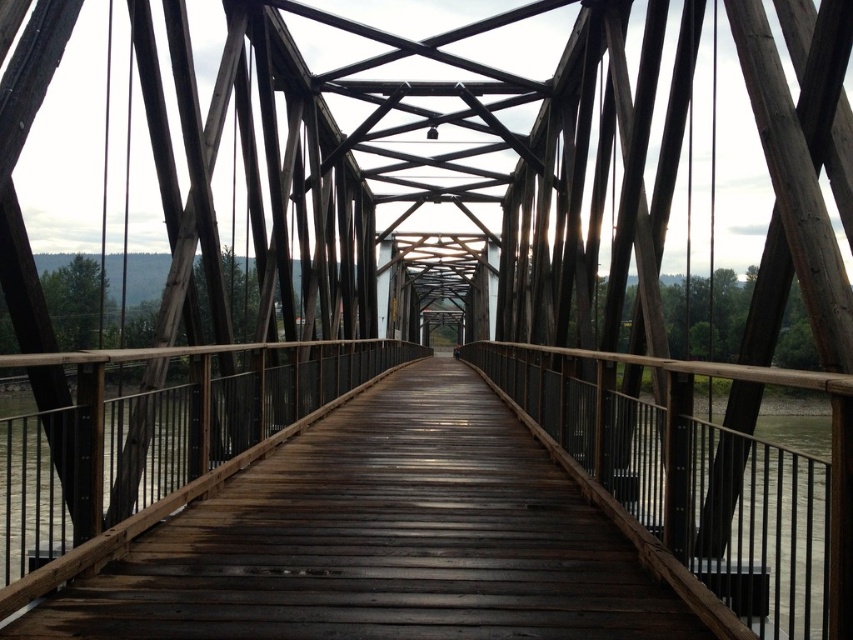
You are standing on the brown wooden bridge at center and want to take a photo of the bridge structure. If your camera is 5.5 feet away from the bridge, will you be able to capture the entire bridge in the photo?

The brown wooden bridge at center and camera are 11.05 feet apart from each other. Since the camera is only 5.5 feet away from the bridge, it is half the required distance. This means the camera is actually 5.5 feet closer than the 11.05 feet separation mentioned. Therefore, you would not be able to capture the entire bridge in the photo because the camera is too close to the bridge structure.

You are standing on the brown wooden bridge at center. If you walk straight ahead, which direction will you be facing relative to the bridge?

Since the brown wooden bridge at center is located at point (379, 538), walking straight ahead along the bridge would keep you aligned with its central axis, so you would continue moving forward along the bridge towards its far end.